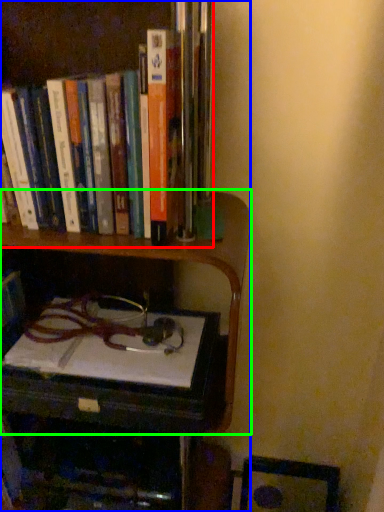
Question: Considering the real-world distances, which object is closest to book (highlighted by a red box)? bookcase (highlighted by a blue box) or shelf (highlighted by a green box).

Choices:
 (A) bookcase
 (B) shelf

Answer: (B)